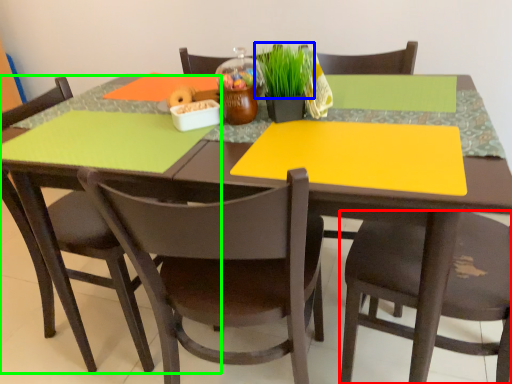
Question: Which object is the closest to the chair (highlighted by a red box)? Choose among these: plant (highlighted by a blue box) or chair (highlighted by a green box).

Choices:
 (A) plant
 (B) chair

Answer: (A)